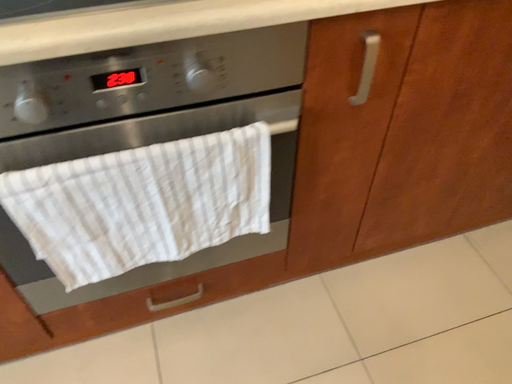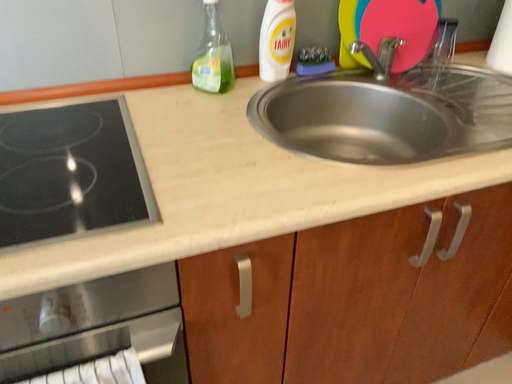
Question: Which way did the camera rotate in the video?

Choices:
 (A) rotated downward
 (B) rotated upward

Answer: (B)